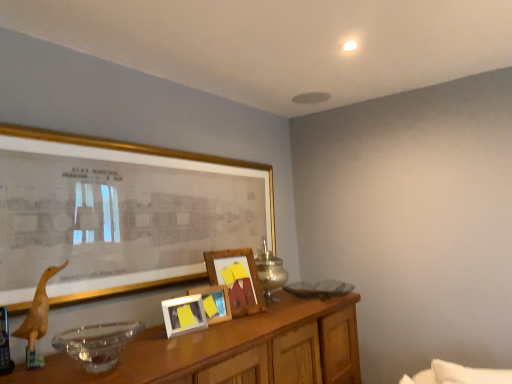
You are a GUI agent. You are given a task and a screenshot of the screen. Output one action in this format:
    pyautogui.click(x=<x>, y=<y>)
    Task: Click on the free space in front of wooden picture frame at center, the third picture frame positioned from the front
    
    Given the screenshot: What is the action you would take?
    pyautogui.click(x=204, y=326)